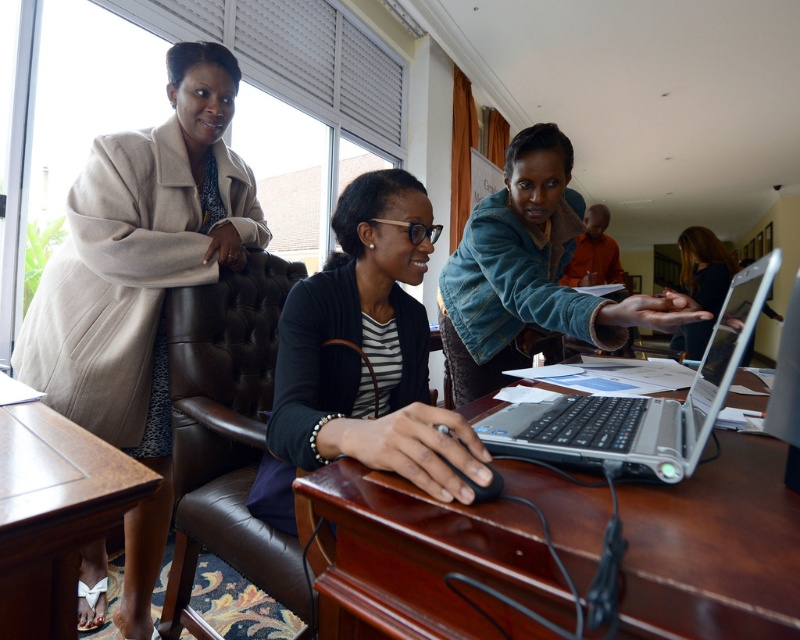
Is the position of black matte glasses at center more distant than that of smooth black hair at center?

No, it is in front of smooth black hair at center.

Measure the distance between black matte glasses at center and smooth black hair at center.

9.41 feet

Who is more distant from viewer, (408, 472) or (692, 324)?

Positioned behind is point (692, 324).

Image resolution: width=800 pixels, height=640 pixels. I want to click on black matte glasses at center, so click(x=362, y=356).

Measure the distance between brown wooden table at center and camera.

The distance of brown wooden table at center from camera is 14.47 inches.

Describe the element at coordinates (420, 557) in the screenshot. I see `brown wooden table at center` at that location.

Identify the location of brown wooden table at center. (420, 557).

Does beige wool coat at upper left have a larger size compared to smooth black hair at center?

No.

Does beige wool coat at upper left appear over smooth black hair at center?

No, beige wool coat at upper left is not above smooth black hair at center.

What do you see at coordinates (140, 285) in the screenshot? This screenshot has width=800, height=640. I see `beige wool coat at upper left` at bounding box center [140, 285].

This screenshot has height=640, width=800. I want to click on beige wool coat at upper left, so click(140, 285).